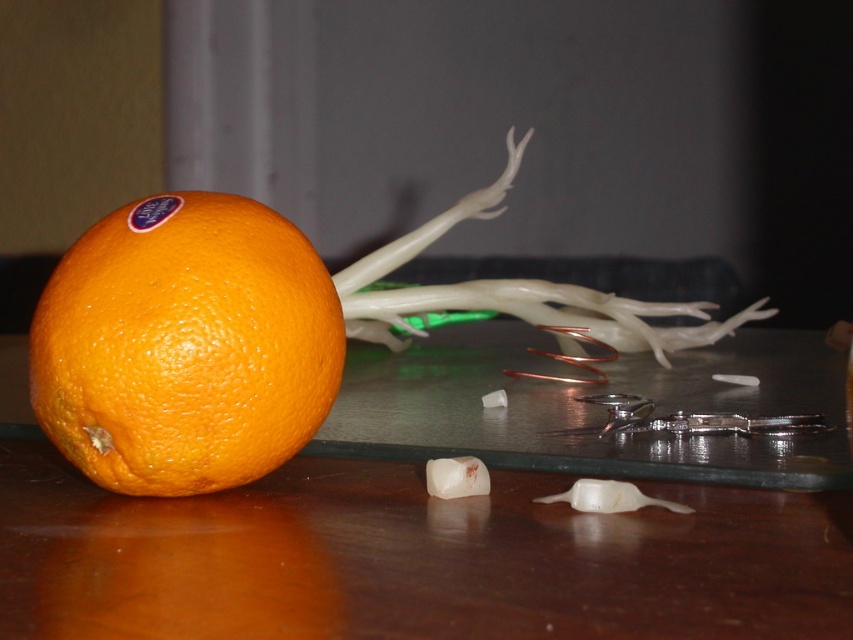
Question: Which object appears farthest from the camera in this image?

Choices:
 (A) orangesmoothfruit at left
 (B) translucent white onion at center
 (C) wooden table at lower left

Answer: (B)

Question: Based on their relative distances, which object is nearer to the orangesmoothfruit at left?

Choices:
 (A) translucent white onion at center
 (B) wooden table at lower left

Answer: (B)

Question: Does wooden table at lower left have a lesser width compared to orangesmoothfruit at left?

Choices:
 (A) no
 (B) yes

Answer: (A)

Question: Is wooden table at lower left wider than orangesmoothfruit at left?

Choices:
 (A) no
 (B) yes

Answer: (B)

Question: Is the position of orangesmoothfruit at left less distant than that of translucent white onion at center?

Choices:
 (A) no
 (B) yes

Answer: (B)

Question: Which object is closer to the camera taking this photo?

Choices:
 (A) wooden table at lower left
 (B) translucent white onion at center
 (C) orangesmoothfruit at left

Answer: (A)